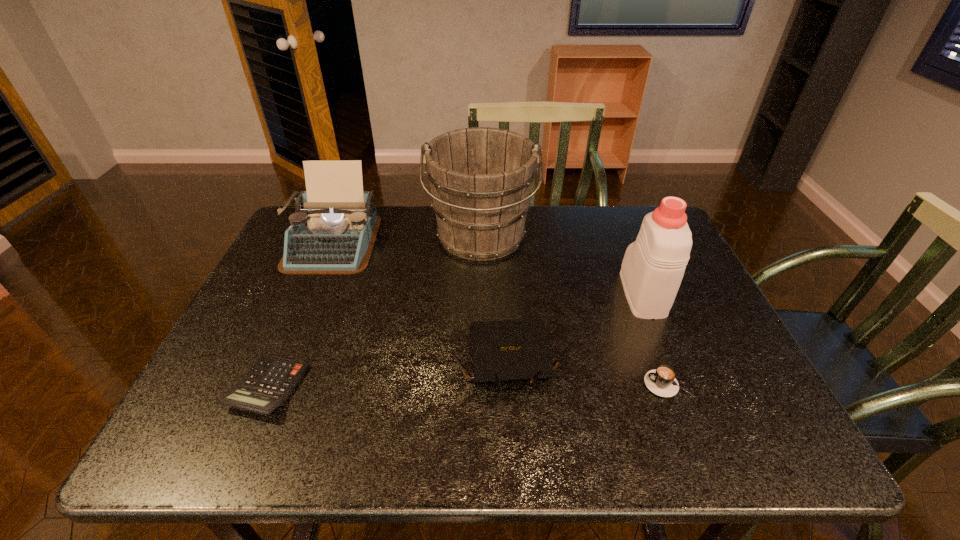
I want to click on vacant area that lies between the calculator and the bucket, so click(x=374, y=313).

This screenshot has width=960, height=540. In order to click on unoccupied position between the calculator and the bucket in this screenshot , I will do `click(374, 313)`.

This screenshot has width=960, height=540. What are the coordinates of `free spot between the detergent and the router` in the screenshot? It's located at (576, 327).

Where is `free space between the router and the typewriter`? free space between the router and the typewriter is located at coordinates (420, 301).

This screenshot has width=960, height=540. What are the coordinates of `free spot between the bucket and the router` in the screenshot? It's located at (495, 299).

At what (x,y) coordinates should I click in order to perform the action: click on empty location between the router and the detergent. Please return your answer as a coordinate pair (x, y). The width and height of the screenshot is (960, 540). Looking at the image, I should click on (576, 327).

Find the location of a particular element. unoccupied area between the detergent and the router is located at coordinates (576, 327).

Where is `free space between the router and the detergent`? The height and width of the screenshot is (540, 960). free space between the router and the detergent is located at coordinates (576, 327).

This screenshot has height=540, width=960. I want to click on vacant region between the detergent and the cappuccino, so click(x=655, y=339).

Identify the location of object that is the fourth closest one to the calculator. pos(661,381).